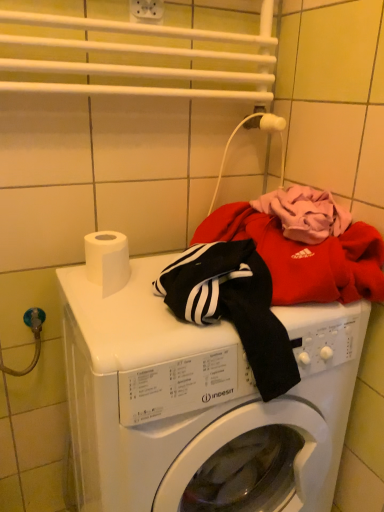
Question: Would you say white matte toilet paper at top left is a long distance from white plastic electric outlet at upper center?

Choices:
 (A) yes
 (B) no

Answer: (B)

Question: Can you confirm if white matte toilet paper at top left is thinner than white plastic electric outlet at upper center?

Choices:
 (A) yes
 (B) no

Answer: (B)

Question: Does white matte toilet paper at top left contain white plastic electric outlet at upper center?

Choices:
 (A) no
 (B) yes

Answer: (A)

Question: Does white matte toilet paper at top left lie in front of white plastic electric outlet at upper center?

Choices:
 (A) yes
 (B) no

Answer: (A)

Question: From a real-world perspective, does white matte toilet paper at top left stand above white plastic electric outlet at upper center?

Choices:
 (A) yes
 (B) no

Answer: (B)

Question: Is white matte toilet paper at top left further to the viewer compared to white plastic electric outlet at upper center?

Choices:
 (A) yes
 (B) no

Answer: (B)

Question: Does white plastic electric outlet at upper center touch white glossy washing machine at center?

Choices:
 (A) no
 (B) yes

Answer: (A)

Question: Considering the relative positions of white plastic electric outlet at upper center and white glossy washing machine at center in the image provided, is white plastic electric outlet at upper center to the left of white glossy washing machine at center from the viewer's perspective?

Choices:
 (A) yes
 (B) no

Answer: (A)

Question: Is white plastic electric outlet at upper center to the right of white glossy washing machine at center from the viewer's perspective?

Choices:
 (A) yes
 (B) no

Answer: (B)

Question: Is white plastic electric outlet at upper center surrounding white glossy washing machine at center?

Choices:
 (A) no
 (B) yes

Answer: (A)

Question: From the image's perspective, is white plastic electric outlet at upper center located beneath white glossy washing machine at center?

Choices:
 (A) yes
 (B) no

Answer: (B)

Question: Considering the relative sizes of white plastic electric outlet at upper center and white glossy washing machine at center in the image provided, is white plastic electric outlet at upper center thinner than white glossy washing machine at center?

Choices:
 (A) yes
 (B) no

Answer: (A)

Question: Does white matte toilet paper at top left lie in front of white glossy washing machine at center?

Choices:
 (A) no
 (B) yes

Answer: (A)